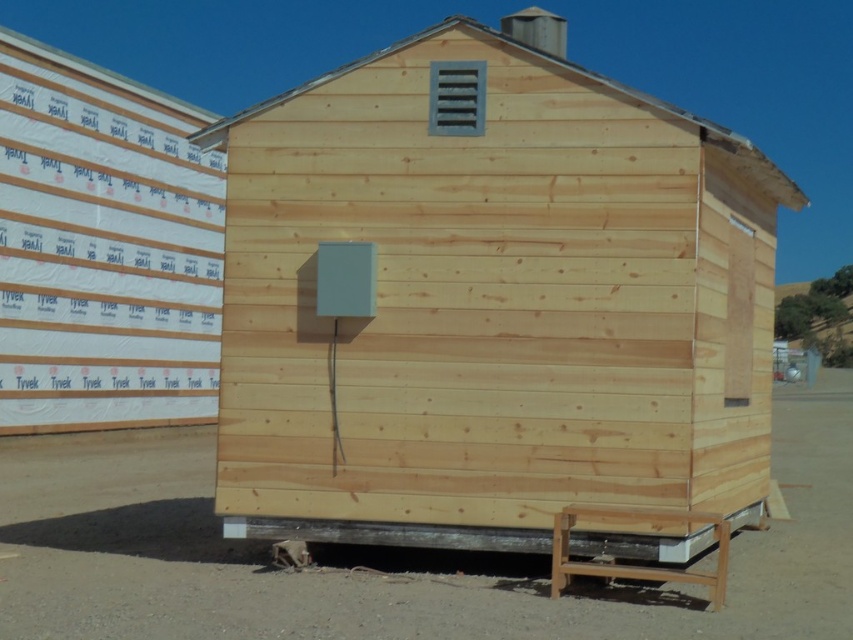
Question: Is natural wood cabin at center below dirt field at lower center?

Choices:
 (A) yes
 (B) no

Answer: (B)

Question: Estimate the real-world distances between objects in this image. Which object is closer to the dirt field at lower center?

Choices:
 (A) natural wood cabin at center
 (B) white tyvek siding at upper left

Answer: (B)

Question: Does dirt field at lower center appear on the left side of white tyvek siding at upper left?

Choices:
 (A) no
 (B) yes

Answer: (A)

Question: Which object is farther from the camera taking this photo?

Choices:
 (A) dirt field at lower center
 (B) natural wood cabin at center
 (C) white tyvek siding at upper left

Answer: (B)

Question: Which point appears farthest from the camera in this image?

Choices:
 (A) pyautogui.click(x=308, y=465)
 (B) pyautogui.click(x=550, y=624)

Answer: (A)

Question: Is the position of dirt field at lower center more distant than that of white tyvek siding at upper left?

Choices:
 (A) yes
 (B) no

Answer: (B)